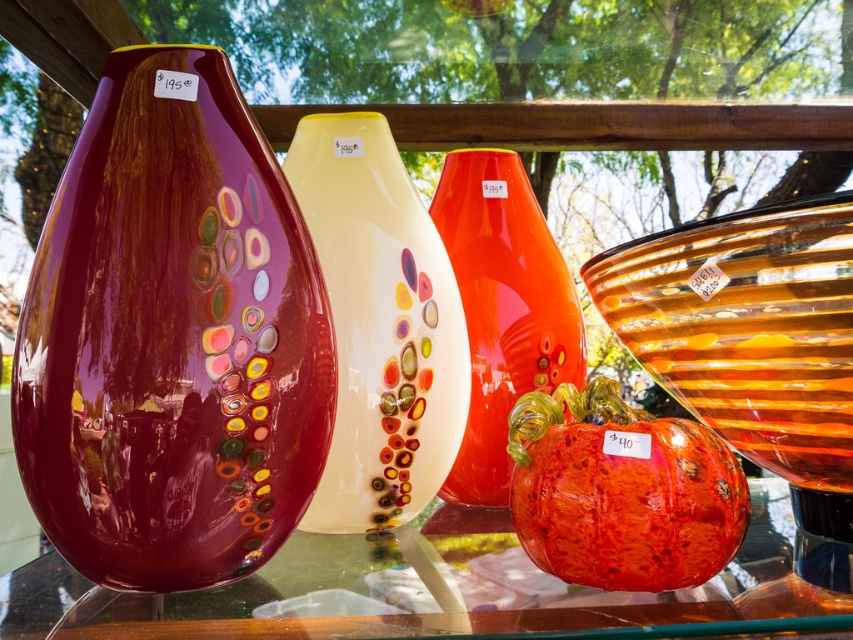
Question: Can you confirm if glossy glass vase at left is positioned to the left of glossy glass vase at center?

Choices:
 (A) yes
 (B) no

Answer: (A)

Question: Which object is closer to the camera taking this photo?

Choices:
 (A) transparent glass table at center
 (B) translucent white vase at center

Answer: (A)

Question: Which point is farther from the camera taking this photo?

Choices:
 (A) (572, 298)
 (B) (508, 532)
 (C) (776, 397)
 (D) (32, 353)

Answer: (A)

Question: Among these points, which one is nearest to the camera?

Choices:
 (A) (843, 371)
 (B) (109, 636)
 (C) (376, 412)
 (D) (466, 317)

Answer: (B)

Question: Does glossy glass vase at left have a greater width compared to translucent white vase at center?

Choices:
 (A) yes
 (B) no

Answer: (A)

Question: Can you confirm if transparent glass table at center is wider than glossy glass vase at center?

Choices:
 (A) yes
 (B) no

Answer: (A)